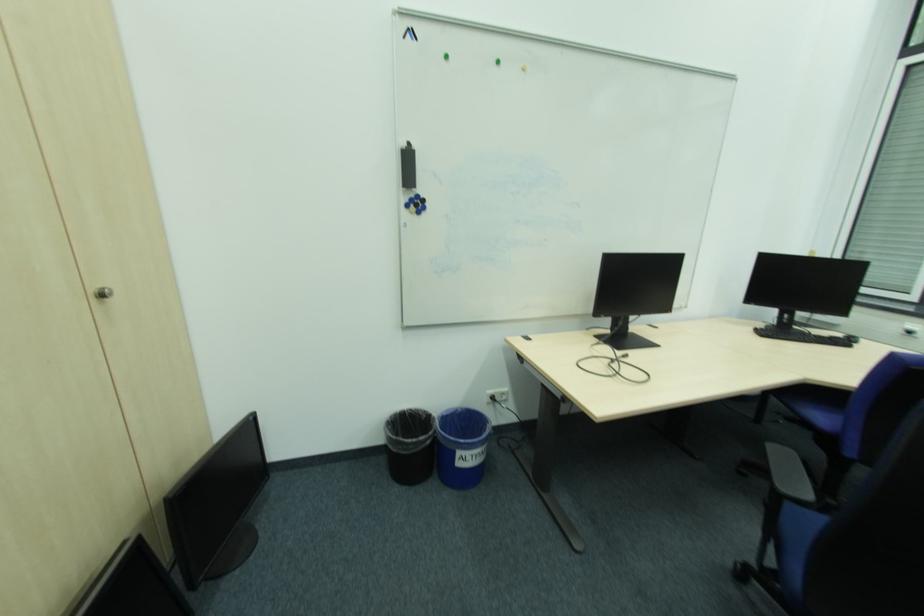
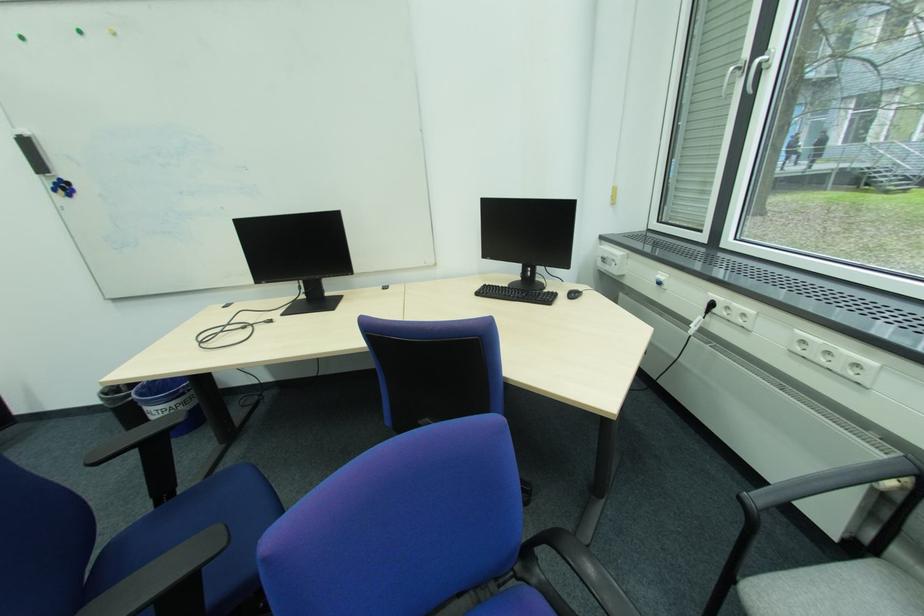
In the second image, find the point that corresponds to the point at 419,201 in the first image.

(62, 185)